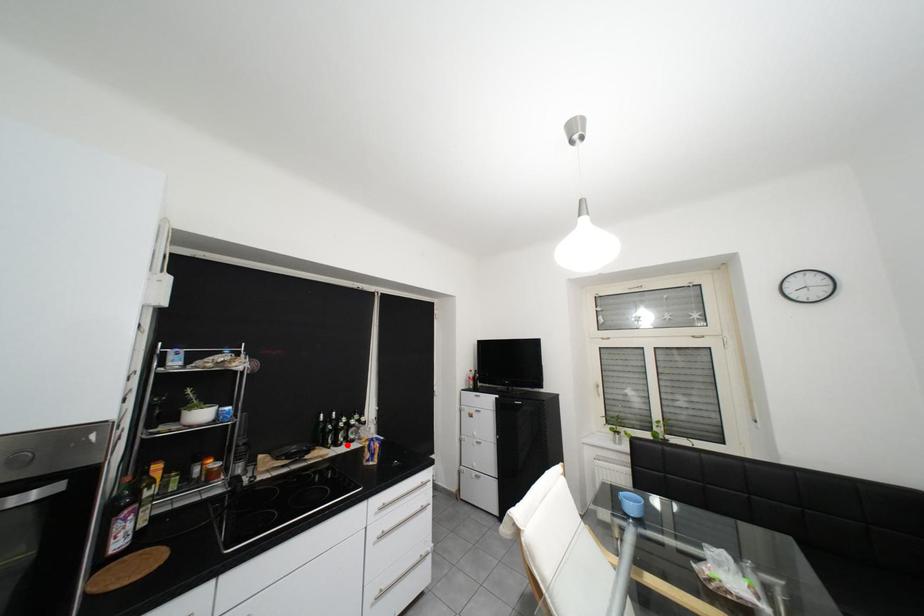
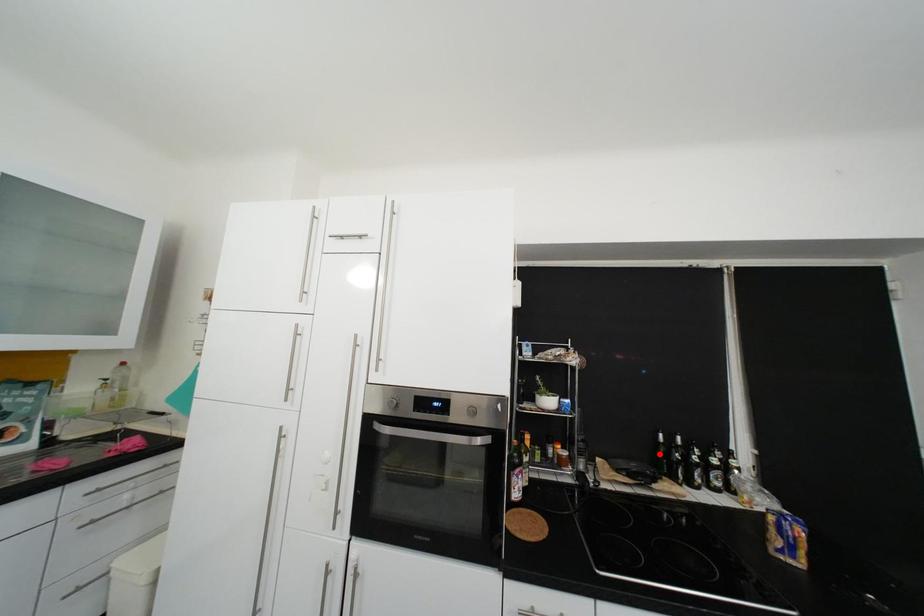
I am providing you with two images of the same scene from different viewpoints. A red point is marked on the first image and another point is marked on the second image. Do the highlighted points in image1 and image2 indicate the same real-world spot?

No